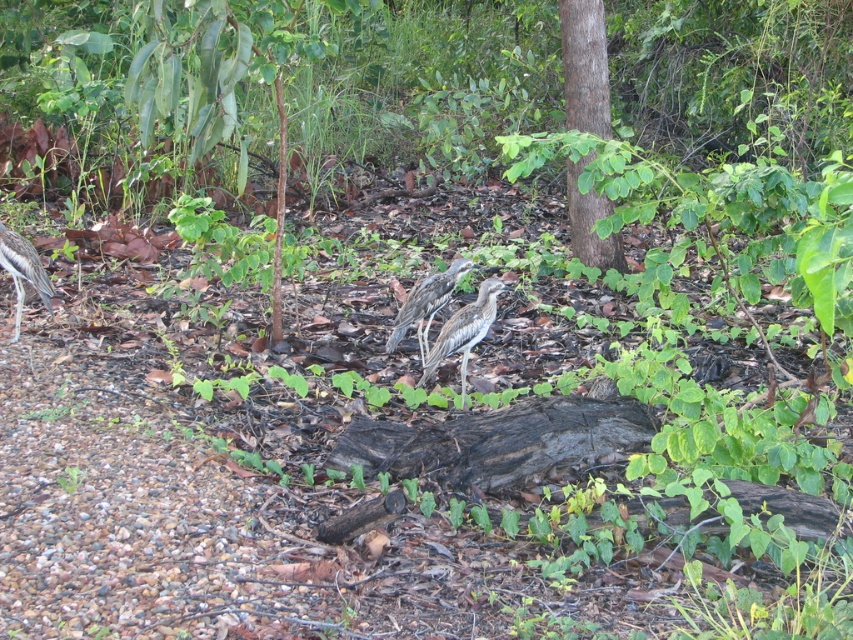
Is point (573, 108) positioned before point (48, 282)?

No.

Locate an element on the screen. The width and height of the screenshot is (853, 640). smooth brown tree at center is located at coordinates (584, 67).

Identify the location of smooth brown tree at center. The width and height of the screenshot is (853, 640). pyautogui.click(x=584, y=67).

This screenshot has width=853, height=640. I want to click on smooth brown tree at center, so click(x=584, y=67).

Image resolution: width=853 pixels, height=640 pixels. Identify the location of smooth brown tree at center. (584, 67).

Which is more to the right, smooth brown tree at center or brown speckled feathers at center?

smooth brown tree at center

Image resolution: width=853 pixels, height=640 pixels. What do you see at coordinates (584, 67) in the screenshot? I see `smooth brown tree at center` at bounding box center [584, 67].

Identify the location of smooth brown tree at center. The image size is (853, 640). (584, 67).

Between speckled feathered bird at center and brown speckled feathers at center, which one appears on the left side from the viewer's perspective?

brown speckled feathers at center

From the picture: Is the position of speckled feathered bird at center less distant than that of brown speckled feathers at center?

Yes, speckled feathered bird at center is closer to the viewer.

Is point (486, 285) less distant than point (413, 291)?

That is True.

You are a GUI agent. You are given a task and a screenshot of the screen. Output one action in this format:
    pyautogui.click(x=<x>, y=<y>)
    Task: Click on the speckled feathered bird at center
    This screenshot has height=640, width=853.
    Given the screenshot: What is the action you would take?
    pyautogui.click(x=463, y=332)